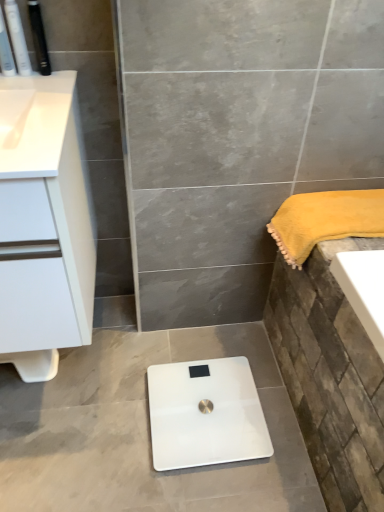
Image resolution: width=384 pixels, height=512 pixels. I want to click on vacant space situated above white glossy scale at center (from a real-world perspective), so click(x=200, y=403).